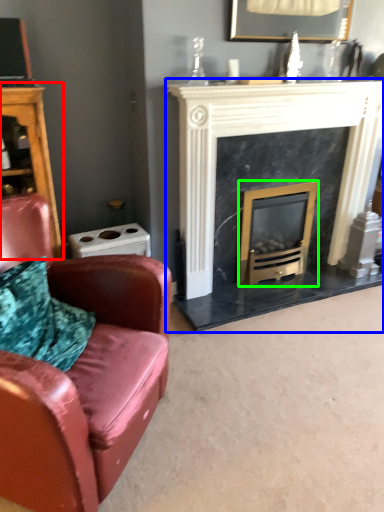
Question: Which object is positioned closest to dresser (highlighted by a red box)? Select from fireplace (highlighted by a blue box) and wood burning stove (highlighted by a green box).

Choices:
 (A) fireplace
 (B) wood burning stove

Answer: (A)